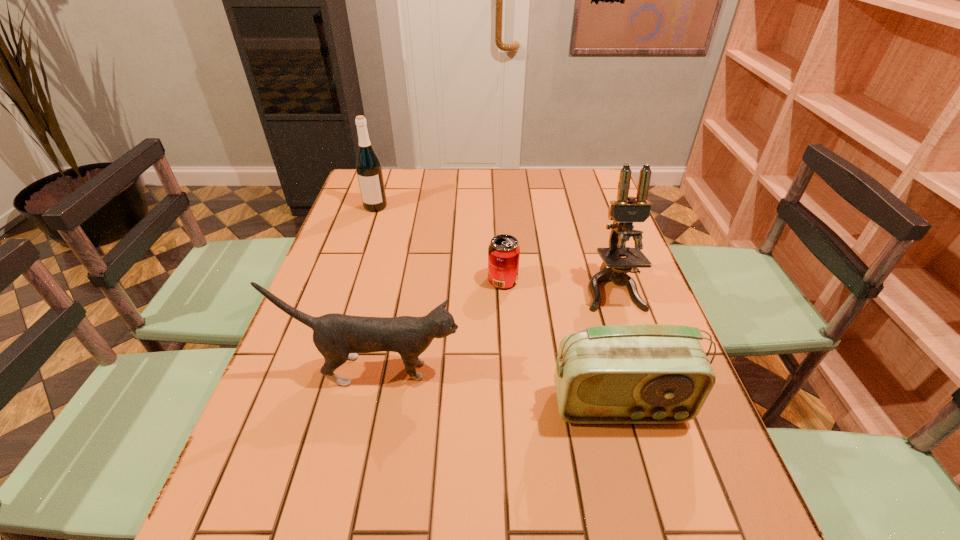
Locate an element on the screen. The image size is (960, 540). vacant space located on the left of the third object from right to left is located at coordinates (440, 280).

The width and height of the screenshot is (960, 540). I want to click on object located at the far edge, so click(x=369, y=171).

I want to click on wine bottle situated at the left edge, so click(369, 171).

Identify the location of cat located in the left edge section of the desktop. This screenshot has width=960, height=540. (338, 337).

This screenshot has height=540, width=960. I want to click on microscope that is at the right edge, so click(x=626, y=210).

The height and width of the screenshot is (540, 960). Find the location of `radio receiver positioned at the right edge`. radio receiver positioned at the right edge is located at coordinates (x=636, y=373).

This screenshot has width=960, height=540. In order to click on object present at the far left corner in this screenshot , I will do `click(369, 171)`.

You are a GUI agent. You are given a task and a screenshot of the screen. Output one action in this format:
    pyautogui.click(x=<x>, y=<y>)
    Task: Click on the vacant position at the far edge of the desktop
    This screenshot has width=960, height=540.
    Given the screenshot: What is the action you would take?
    pyautogui.click(x=496, y=183)

The image size is (960, 540). I want to click on vacant space at the left edge of the desktop, so point(291,448).

Locate an element on the screen. free space between the farthest object and the third object from left to right is located at coordinates (440, 244).